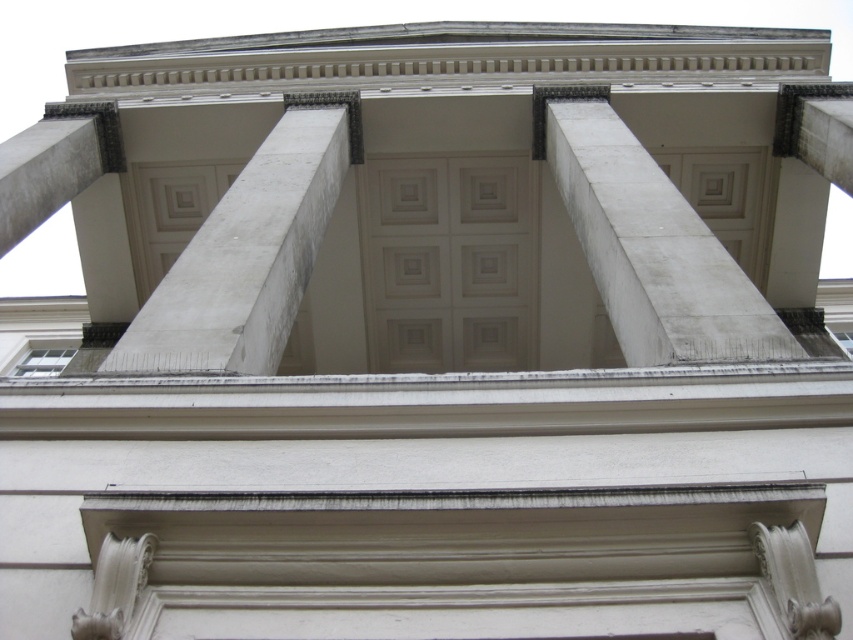
Between white concrete column at center and white marble pillar at center, which one is positioned lower?

Positioned lower is white marble pillar at center.

This screenshot has width=853, height=640. What do you see at coordinates (651, 248) in the screenshot?
I see `white concrete column at center` at bounding box center [651, 248].

Where is `white concrete column at center`? white concrete column at center is located at coordinates (651, 248).